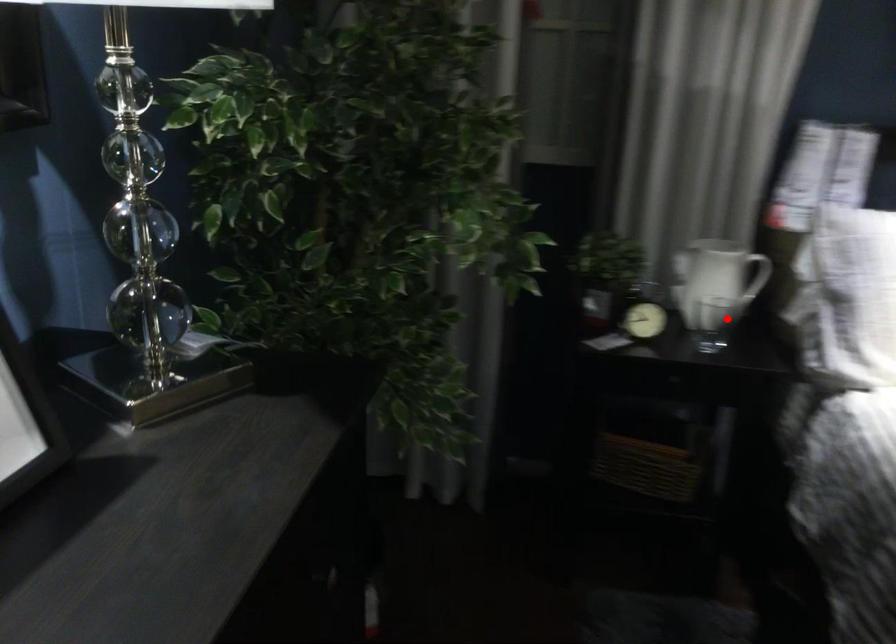
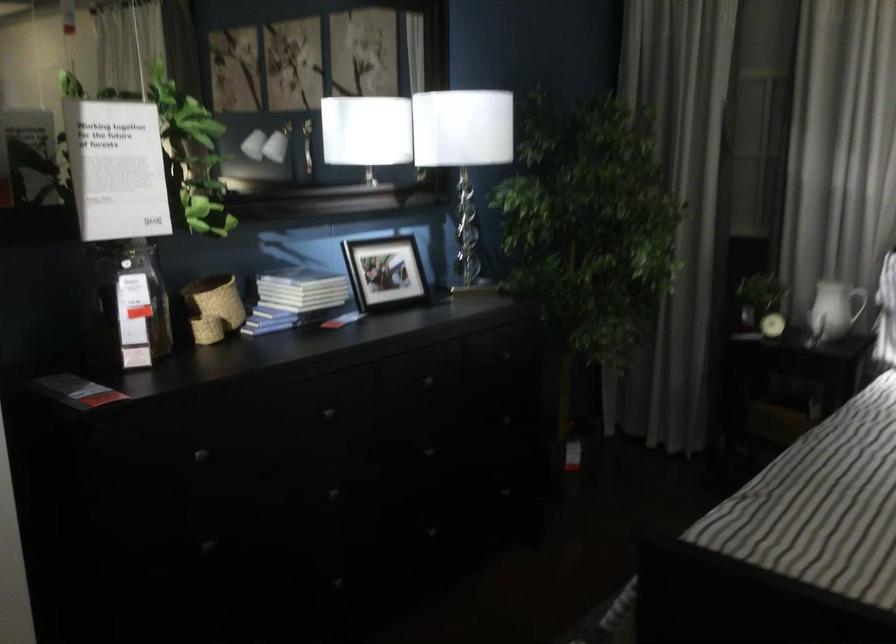
In the second image, find the point that corresponds to the highlighted location in the first image.

(823, 313)